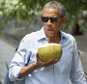
Where is `bowl`? This screenshot has height=84, width=87. bowl is located at coordinates (49, 53).